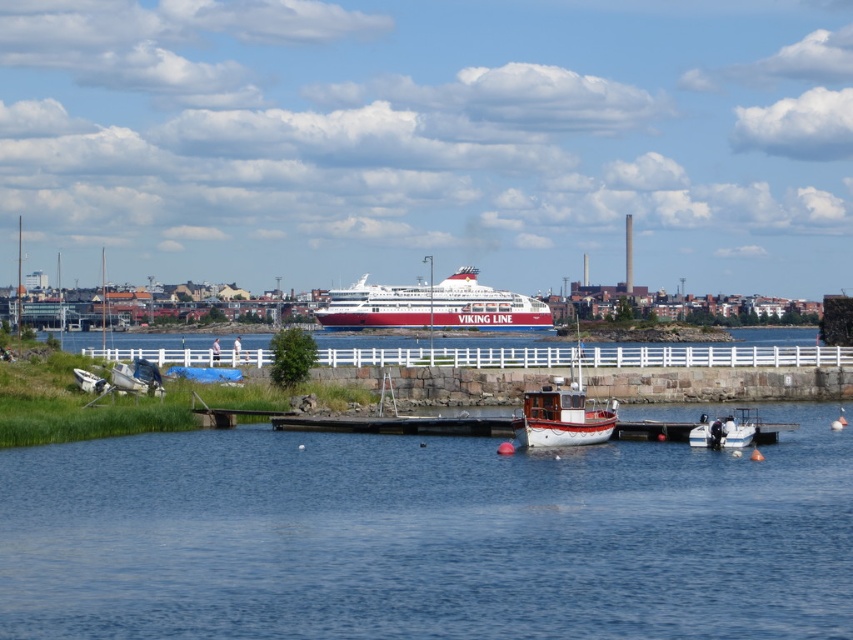
Question: Which of the following is the farthest from the observer?

Choices:
 (A) (527, 410)
 (B) (735, 440)

Answer: (A)

Question: Does white matte boat at center have a larger size compared to white matte boat at lower right?

Choices:
 (A) yes
 (B) no

Answer: (A)

Question: Which of the following is the closest to the observer?

Choices:
 (A) blue water at center
 (B) white/red painted ferry at center

Answer: (A)

Question: Which object appears closest to the camera in this image?

Choices:
 (A) white matte boat at center
 (B) white/red painted ferry at center

Answer: (A)

Question: Is white/red painted ferry at center above white matte boat at center?

Choices:
 (A) yes
 (B) no

Answer: (A)

Question: Does white matte boat at center have a larger size compared to white matte boat at lower right?

Choices:
 (A) no
 (B) yes

Answer: (B)